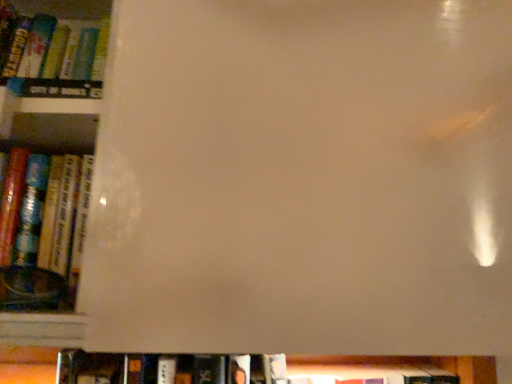
Question: Relative to hardcover book at left, acting as the 2th book starting from the bottom, is hardcover book at lower center, which appears as the 2th book when viewed from the front, in front or behind?

Choices:
 (A) front
 (B) behind

Answer: (B)

Question: In the image, is hardcover book at lower center, the 2th book positioned from the top, on the left side or the right side of hardcover book at left, acting as the 2th book starting from the bottom?

Choices:
 (A) right
 (B) left

Answer: (A)

Question: Based on their sizes in the image, would you say hardcover book at lower center, the 2th book positioned from the top, is bigger or smaller than hardcover book at left, which is the first book in top-to-bottom order?

Choices:
 (A) big
 (B) small

Answer: (A)

Question: In terms of width, does hardcover book at left, which is the first book in top-to-bottom order, look wider or thinner when compared to hardcover book at lower center, the 2th book positioned from the top?

Choices:
 (A) wide
 (B) thin

Answer: (B)

Question: Is hardcover book at left, which is the first book in top-to-bottom order, to the left or to the right of hardcover book at lower center, the 2th book positioned from the top, in the image?

Choices:
 (A) right
 (B) left

Answer: (B)

Question: Choose the correct answer: Is hardcover book at left, the 2th book from the back, inside hardcover book at lower center, the 1th book in the bottom-to-top sequence, or outside it?

Choices:
 (A) outside
 (B) inside

Answer: (A)

Question: From a real-world perspective, relative to hardcover book at lower center, the first book viewed from the back, is hardcover book at left, which is the first book in top-to-bottom order, vertically above or below?

Choices:
 (A) below
 (B) above

Answer: (B)